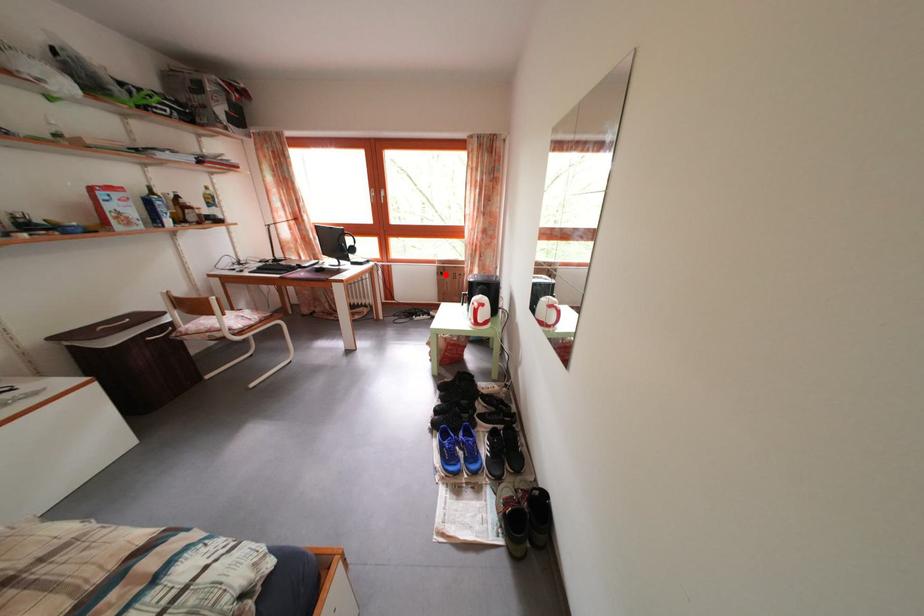
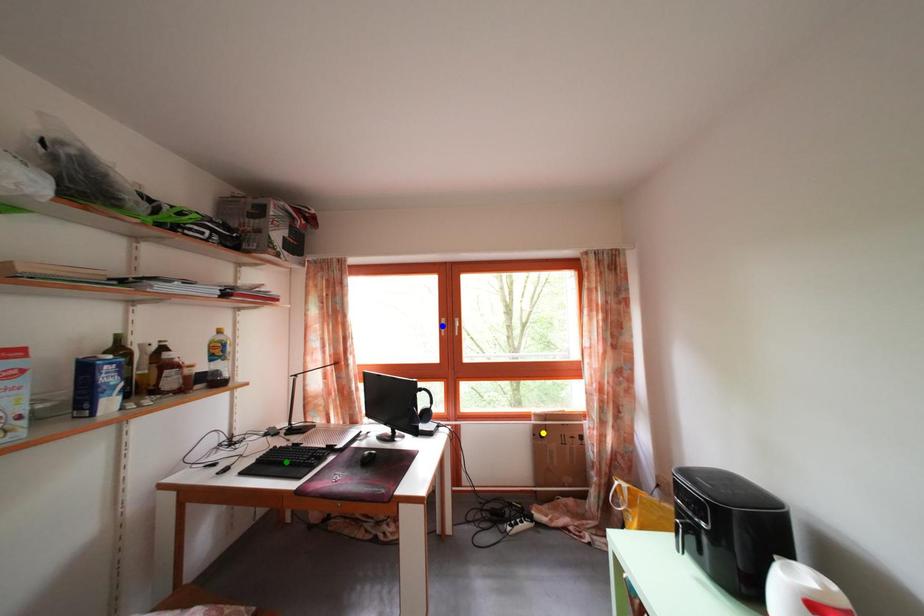
Question: I am providing you with two images of the same scene from different viewpoints. A red point is marked on the first image. You are given multiple points on the second image. Which mark in image 2 goes with the point in image 1?

Choices:
 (A) green point
 (B) yellow point
 (C) blue point

Answer: (B)